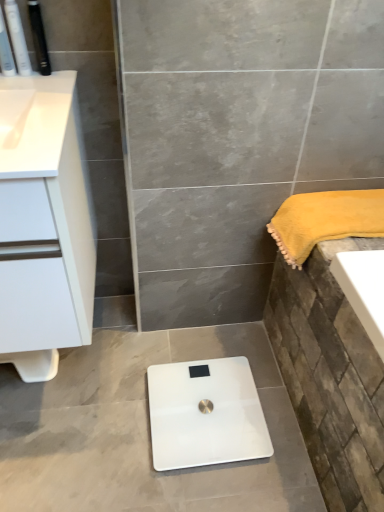
Question: Can you confirm if black plastic toothbrush at upper left, acting as the 1th toiletry starting from the right, is wider than white glossy scale at center?

Choices:
 (A) yes
 (B) no

Answer: (B)

Question: Is black plastic toothbrush at upper left, positioned as the third toiletry in left-to-right order, taller than white glossy scale at center?

Choices:
 (A) yes
 (B) no

Answer: (A)

Question: Is black plastic toothbrush at upper left, acting as the 1th toiletry starting from the right, smaller than white glossy scale at center?

Choices:
 (A) yes
 (B) no

Answer: (A)

Question: Can you confirm if black plastic toothbrush at upper left, positioned as the third toiletry in left-to-right order, is positioned to the left of white glossy scale at center?

Choices:
 (A) no
 (B) yes

Answer: (B)

Question: From the image's perspective, is black plastic toothbrush at upper left, acting as the 1th toiletry starting from the right, below white glossy scale at center?

Choices:
 (A) no
 (B) yes

Answer: (A)

Question: Does black plastic toothbrush at upper left, acting as the 1th toiletry starting from the right, lie in front of white glossy scale at center?

Choices:
 (A) yes
 (B) no

Answer: (A)

Question: Is black plastic toothbrush at upper left, positioned as the third toiletry in left-to-right order, completely or partially outside of matte black toothbrush at upper left, the third toiletry positioned from the right?

Choices:
 (A) no
 (B) yes

Answer: (B)

Question: Is black plastic toothbrush at upper left, positioned as the third toiletry in left-to-right order, wider than matte black toothbrush at upper left, positioned as the first toiletry in left-to-right order?

Choices:
 (A) yes
 (B) no

Answer: (B)

Question: Is black plastic toothbrush at upper left, acting as the 1th toiletry starting from the right, at the right side of matte black toothbrush at upper left, the third toiletry positioned from the right?

Choices:
 (A) no
 (B) yes

Answer: (B)

Question: From the image's perspective, is black plastic toothbrush at upper left, acting as the 1th toiletry starting from the right, on matte black toothbrush at upper left, positioned as the first toiletry in left-to-right order?

Choices:
 (A) no
 (B) yes

Answer: (B)

Question: Does black plastic toothbrush at upper left, acting as the 1th toiletry starting from the right, have a greater height compared to matte black toothbrush at upper left, positioned as the first toiletry in left-to-right order?

Choices:
 (A) yes
 (B) no

Answer: (B)

Question: Considering the relative sizes of black plastic toothbrush at upper left, acting as the 1th toiletry starting from the right, and matte black toothbrush at upper left, the third toiletry positioned from the right, in the image provided, is black plastic toothbrush at upper left, acting as the 1th toiletry starting from the right, thinner than matte black toothbrush at upper left, the third toiletry positioned from the right,?

Choices:
 (A) yes
 (B) no

Answer: (A)

Question: From a real-world perspective, is white matte cabinet at left physically above matte black toothbrush at upper left, the third toiletry positioned from the right?

Choices:
 (A) no
 (B) yes

Answer: (A)